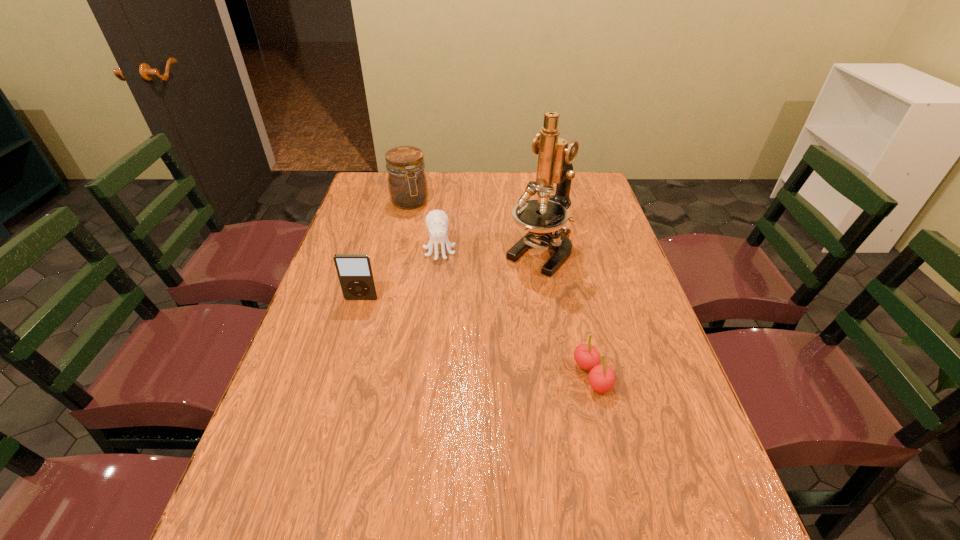
The width and height of the screenshot is (960, 540). What are the coordinates of `the third tallest object` in the screenshot? It's located at (355, 272).

Locate an element on the screen. This screenshot has width=960, height=540. iPod is located at coordinates (355, 272).

Find the location of a particular element. The width and height of the screenshot is (960, 540). the nearest object is located at coordinates (601, 377).

This screenshot has width=960, height=540. Identify the location of cherry. click(601, 377).

Find the location of a particular element. jar is located at coordinates (407, 183).

Locate an element on the screen. The image size is (960, 540). the farthest object is located at coordinates (407, 183).

Find the location of a particular element. microscope is located at coordinates (544, 219).

The image size is (960, 540). Identify the location of the third object from right to left. (437, 221).

The image size is (960, 540). Identify the location of octopus. click(437, 221).

Identify the location of free spot located on the front-facing side of the iPod. coord(331,402).